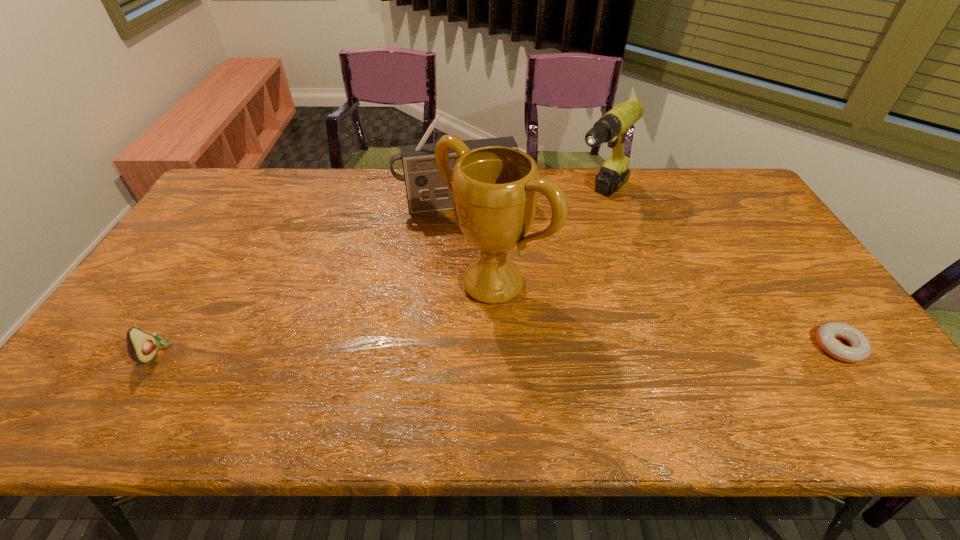
Image resolution: width=960 pixels, height=540 pixels. Find the location of `object that stands as the closest to the avocado`. object that stands as the closest to the avocado is located at coordinates (495, 189).